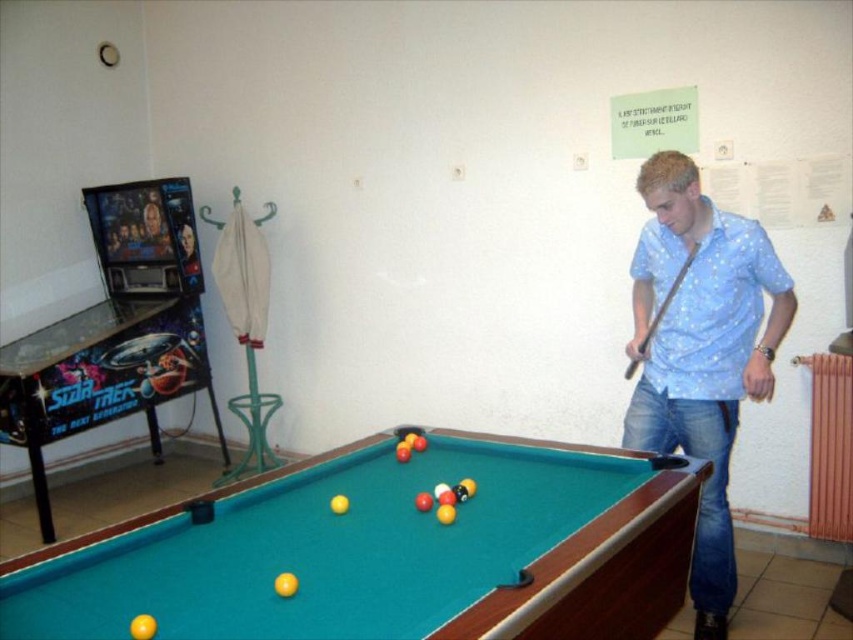
Question: Is blue dotted shirt at center smaller than blue dotted shirt at right?

Choices:
 (A) yes
 (B) no

Answer: (B)

Question: Which point is closer to the camera?

Choices:
 (A) green felt billiard table at center
 (B) wooden smooth cue at right
 (C) blue dotted shirt at center

Answer: (A)

Question: From the image, what is the correct spatial relationship of green felt billiard table at center in relation to wooden smooth cue at right?

Choices:
 (A) below
 (B) above

Answer: (A)

Question: Does blue dotted shirt at center appear over wooden smooth cue at right?

Choices:
 (A) yes
 (B) no

Answer: (B)

Question: Which point appears closest to the camera in this image?

Choices:
 (A) (712, 221)
 (B) (285, 627)

Answer: (B)

Question: Which is nearer to the blue dotted shirt at center?

Choices:
 (A) green felt billiard table at center
 (B) wooden smooth cue at right
 (C) blue dotted shirt at right

Answer: (C)